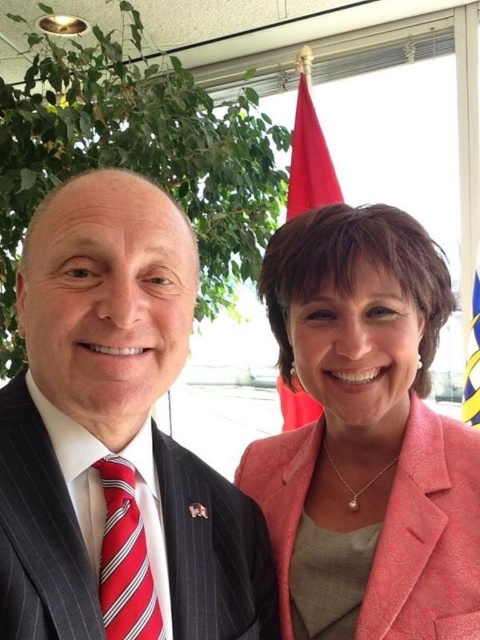
Looking at this image, can you confirm if pink textured blazer at center is wider than red fabric flag at upper center?

Yes.

Between pink textured blazer at center and red fabric flag at upper center, which one appears on the right side from the viewer's perspective?

red fabric flag at upper center is more to the right.

Is point (395, 390) behind point (292, 177)?

That is False.

The height and width of the screenshot is (640, 480). In order to click on pink textured blazer at center in this screenshot , I will do `click(370, 422)`.

Who is positioned more to the right, pink textured blazer at center or red striped tie at left?

Positioned to the right is pink textured blazer at center.

Who is lower down, pink textured blazer at center or red striped tie at left?

red striped tie at left is lower down.

Who is more distant from viewer, [361,381] or [137,630]?

Point [361,381]

I want to click on pink textured blazer at center, so click(x=370, y=422).

Which is above, pinstriped suit at center or red fabric flag at upper center?

red fabric flag at upper center

Describe the element at coordinates (107, 301) in the screenshot. This screenshot has width=480, height=640. I see `pinstriped suit at center` at that location.

Describe the element at coordinates (107, 301) in the screenshot. I see `pinstriped suit at center` at that location.

Where is `pinstriped suit at center`? This screenshot has width=480, height=640. pinstriped suit at center is located at coordinates (107, 301).